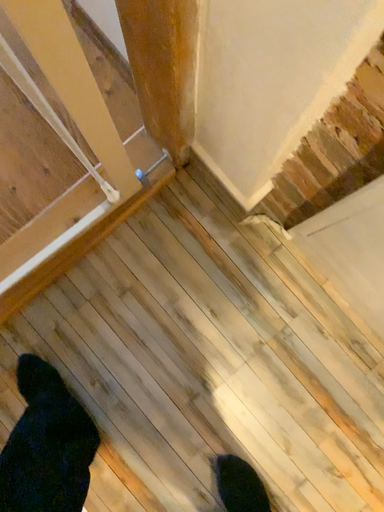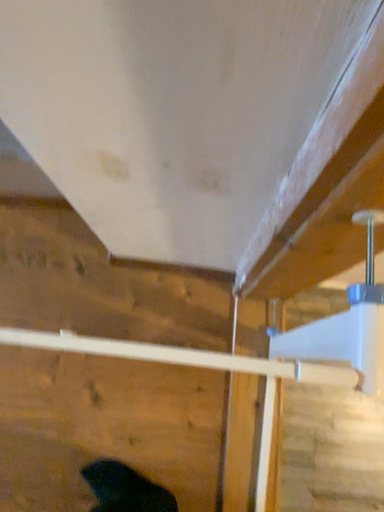
Question: Which way did the camera rotate in the video?

Choices:
 (A) rotated downward
 (B) rotated upward

Answer: (B)